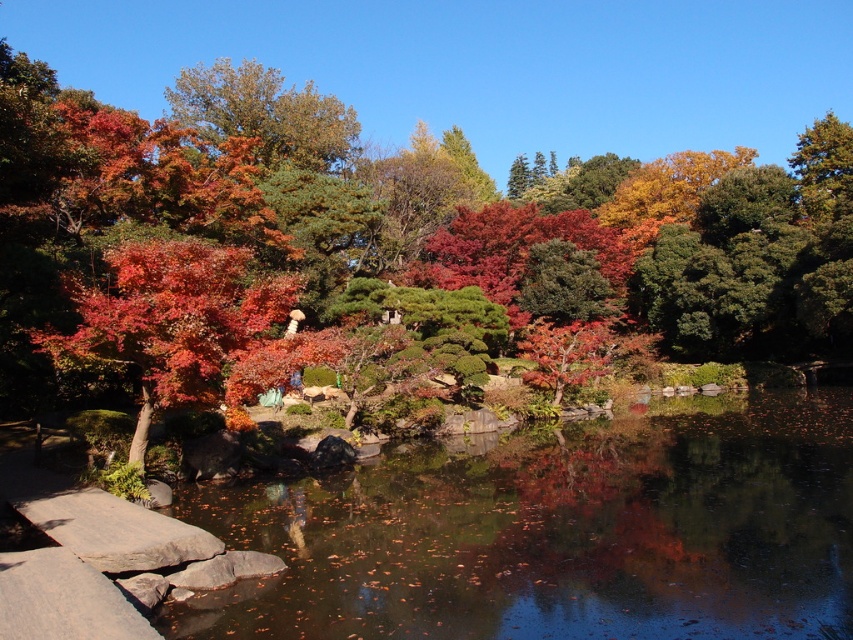
You are standing at the edge of the pond and notice both the glossy reflective water at center and the shiny red maple tree at center. Which object is positioned to the right of the other?

The glossy reflective water at center is to the right of the shiny red maple tree at center.

You are standing at point (556, 531) in the autumnal Japanese garden scene. What do you see directly beneath your feet?

You are standing on the glossy reflective water at center located at point (556, 531).

You are standing in the Japanese garden and want to place a small statue between the two points marked as point (440, 554) and point (82, 307). Since you want the statue to be closer to the viewer, which point should you position it near?

You should position the statue near point (440, 554) because it is closer to the viewer than point (82, 307).